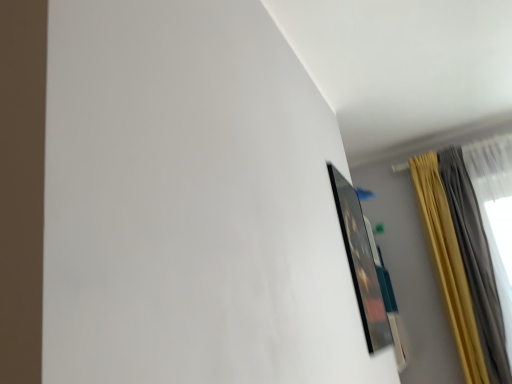
Question: From a real-world perspective, is silky yellow curtain at upper right above or below matte black picture frame at upper right?

Choices:
 (A) above
 (B) below

Answer: (A)

Question: Based on their sizes in the image, would you say silky yellow curtain at upper right is bigger or smaller than matte black picture frame at upper right?

Choices:
 (A) small
 (B) big

Answer: (B)

Question: From the image's perspective, relative to matte black picture frame at upper right, is silky yellow curtain at upper right above or below?

Choices:
 (A) below
 (B) above

Answer: (A)

Question: Is point (355, 205) positioned closer to the camera than point (488, 334)?

Choices:
 (A) closer
 (B) farther

Answer: (A)

Question: Looking at their shapes, would you say matte black picture frame at upper right is wider or thinner than silky yellow curtain at upper right?

Choices:
 (A) wide
 (B) thin

Answer: (B)

Question: Based on their sizes in the image, would you say matte black picture frame at upper right is bigger or smaller than silky yellow curtain at upper right?

Choices:
 (A) small
 (B) big

Answer: (A)

Question: Is matte black picture frame at upper right situated inside silky yellow curtain at upper right or outside?

Choices:
 (A) outside
 (B) inside

Answer: (A)